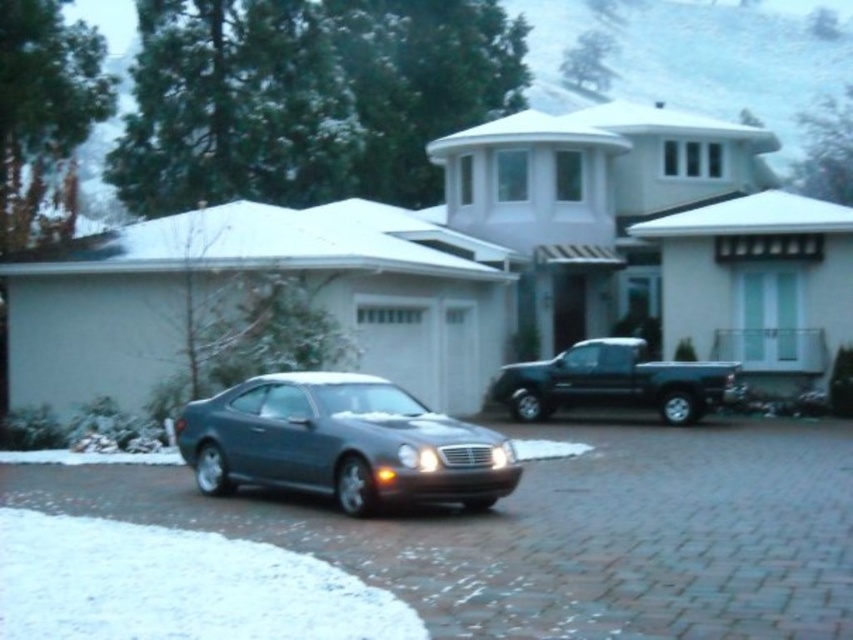
You are a delivery driver who needs to park your vehicle in the driveway without blocking the entrance to the garage. The driveway has a paved area with reddish brown bricks and a satin silver car at center. Where should you park your vehicle to ensure it doesn not block the garage entrance?

The satin silver car at center is located at point (x=564, y=531), so you should park your vehicle away from that position to avoid blocking the garage entrance.

You are standing at the entrance of the driveway and see the point marked at coordinates (564, 531). What object is located at that point?

The point at coordinates 0.832, 0.662 marks the satin silver car at center.